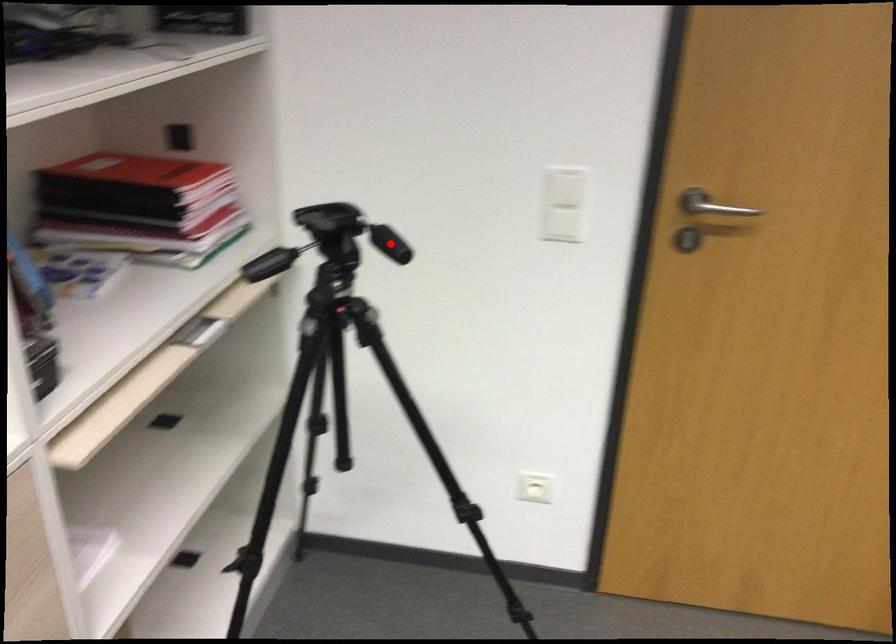
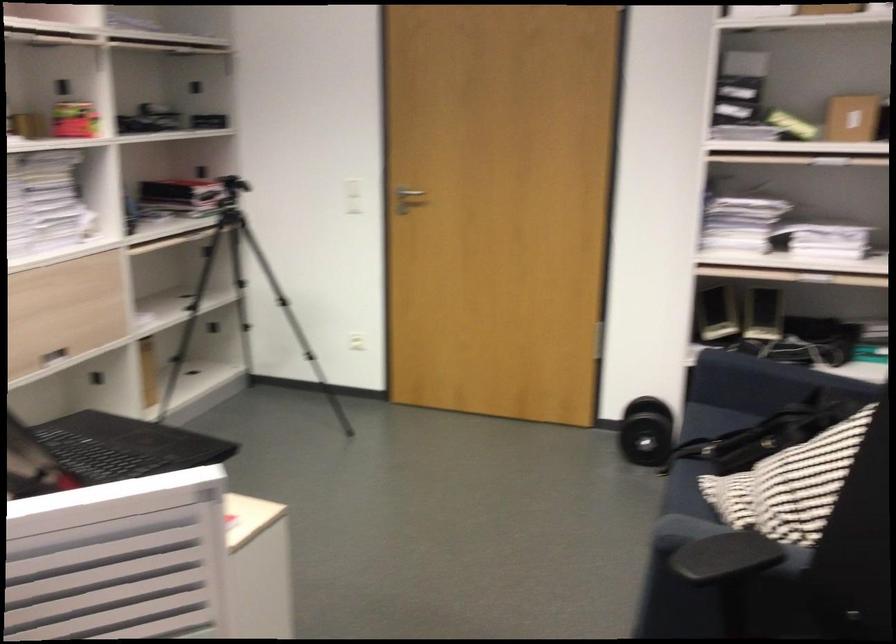
Question: I am providing you with two images of the same scene from different viewpoints. A red point is marked on the first image. Is the red point's position out of view in image 2?

Choices:
 (A) Yes
 (B) No

Answer: (A)